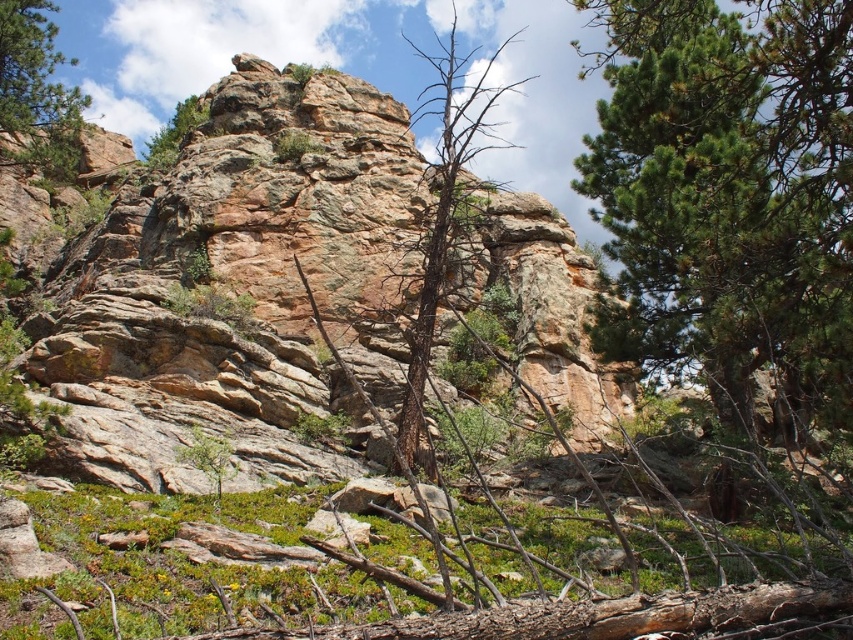
You are a hiker trying to navigate through the rugged landscape. You see the green textured tree at center and the green pine tree at upper left. Which tree is positioned higher up in the image?

The green textured tree at center is located above the green pine tree at upper left, so it is positioned higher up in the image.

You are a hiker trying to navigate through the rugged landscape. You see the rustic stone cliff at center and the green textured tree at center. Which object is positioned lower in the scene?

The rustic stone cliff at center is located below the green textured tree at center, so it is positioned lower in the scene.